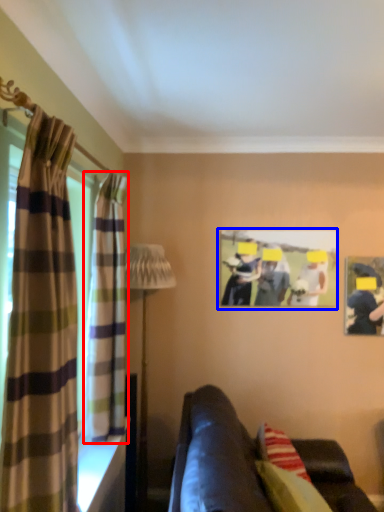
Question: Which of the following is the farthest to the observer, curtain (highlighted by a red box) or picture frame (highlighted by a blue box)?

Choices:
 (A) curtain
 (B) picture frame

Answer: (B)